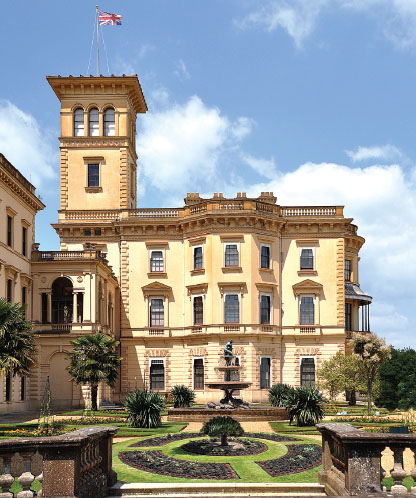
The height and width of the screenshot is (498, 416). Identify the location of door. 59,374.